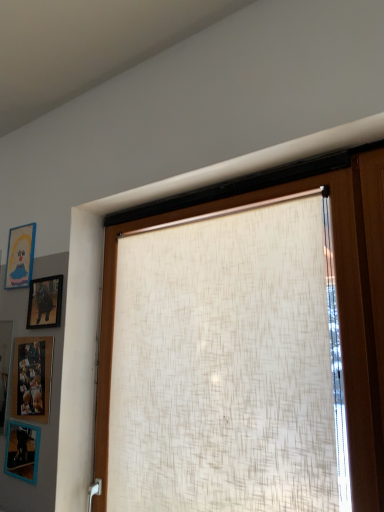
Question: Is blue matte picture frame at upper left, marked as the 4th picture frame in a bottom-to-top arrangement, thinner than beige textured roller blind at center?

Choices:
 (A) no
 (B) yes

Answer: (B)

Question: Is blue matte picture frame at upper left, which is the 1th picture frame in top-to-bottom order, oriented away from beige textured roller blind at center?

Choices:
 (A) no
 (B) yes

Answer: (A)

Question: Does blue matte picture frame at upper left, marked as the 4th picture frame in a bottom-to-top arrangement, lie behind beige textured roller blind at center?

Choices:
 (A) no
 (B) yes

Answer: (B)

Question: Is blue matte picture frame at upper left, marked as the 4th picture frame in a bottom-to-top arrangement, bigger than beige textured roller blind at center?

Choices:
 (A) yes
 (B) no

Answer: (B)

Question: Is blue matte picture frame at upper left, which is the 1th picture frame in top-to-bottom order, at the left side of beige textured roller blind at center?

Choices:
 (A) no
 (B) yes

Answer: (B)

Question: From the image's perspective, is blue matte picture frame at upper left, which is the 1th picture frame in top-to-bottom order, below beige textured roller blind at center?

Choices:
 (A) yes
 (B) no

Answer: (B)

Question: From the image's perspective, is beige textured roller blind at center on top of blue matte picture frame at upper left, which is the 1th picture frame in top-to-bottom order?

Choices:
 (A) yes
 (B) no

Answer: (B)

Question: Does beige textured roller blind at center have a larger size compared to blue matte picture frame at upper left, marked as the 4th picture frame in a bottom-to-top arrangement?

Choices:
 (A) no
 (B) yes

Answer: (B)

Question: Is beige textured roller blind at center completely or partially outside of blue matte picture frame at upper left, marked as the 4th picture frame in a bottom-to-top arrangement?

Choices:
 (A) yes
 (B) no

Answer: (A)

Question: Is beige textured roller blind at center turned away from blue matte picture frame at upper left, which is the 1th picture frame in top-to-bottom order?

Choices:
 (A) yes
 (B) no

Answer: (B)

Question: Does beige textured roller blind at center appear on the left side of blue matte picture frame at upper left, which is the 1th picture frame in top-to-bottom order?

Choices:
 (A) yes
 (B) no

Answer: (B)

Question: Is beige textured roller blind at center taller than blue matte picture frame at upper left, marked as the 4th picture frame in a bottom-to-top arrangement?

Choices:
 (A) yes
 (B) no

Answer: (A)

Question: From a real-world perspective, is beige textured roller blind at center located beneath wooden picture frame at lower left, placed as the third picture frame when sorted from top to bottom?

Choices:
 (A) yes
 (B) no

Answer: (B)